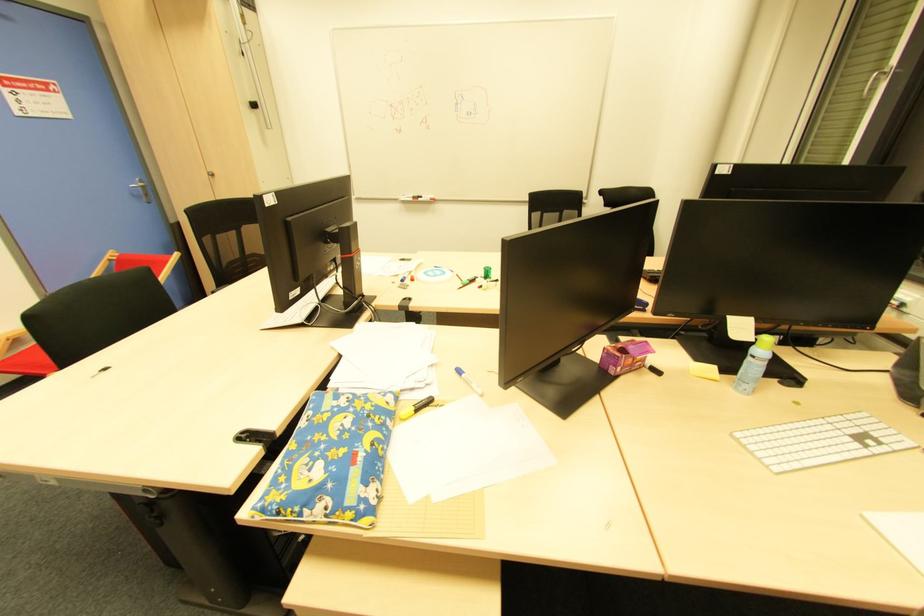
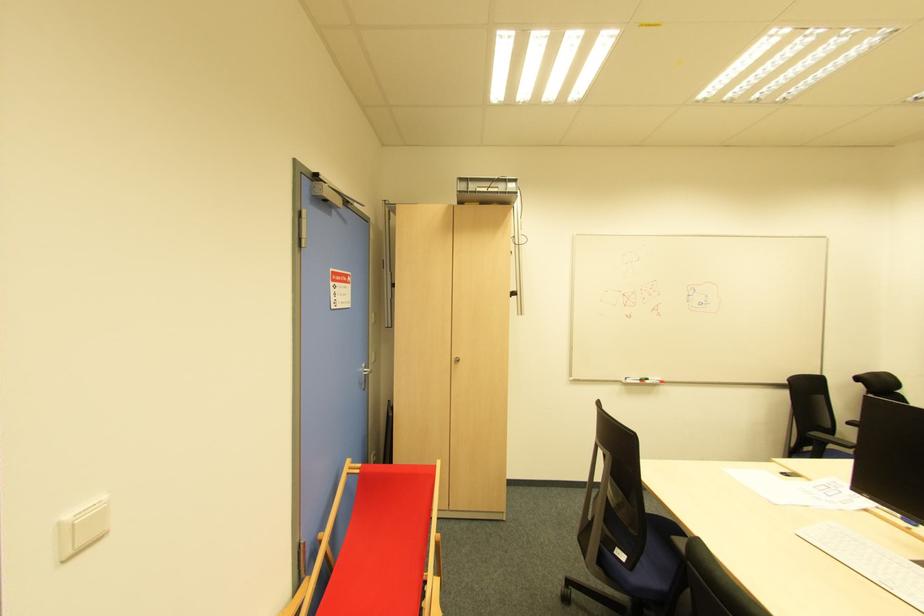
In the second image, find the point that corresponds to [115,264] in the first image.

(357, 477)